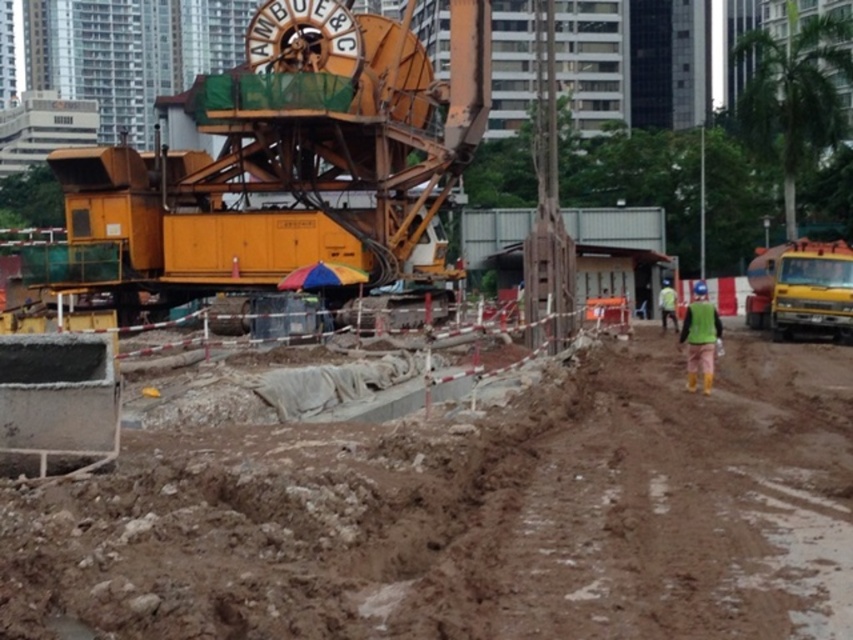
You are a construction worker standing at the base of the yellow construction machine. You need to place a safety barrier between the two points labeled point (196,472) and point (686,365). Which point should you start placing the barrier closer to the machine?

You should start placing the barrier closer to point (196,472) because it is closer to the viewer than point (686,365), meaning it is nearer to the machine where you are standing.

You are a construction supervisor looking at the site layout. You need to place a new safety sign between the brown clay dirt field at lower left and the green fabric construction worker at right. Where should you position it?

The safety sign should be placed between the brown clay dirt field at lower left and the green fabric construction worker at right, as the brown clay dirt field at lower left is located to the left of the green fabric construction worker at right.

You are a safety inspector on the construction site. You need to ensure that the brown clay dirt field at lower left and the green fabric construction worker at right are at safe heights according to regulations. Based on the scene, which object is lower in height?

The brown clay dirt field at lower left has a lesser height compared to the green fabric construction worker at right, so the brown clay dirt field at lower left is lower in height.